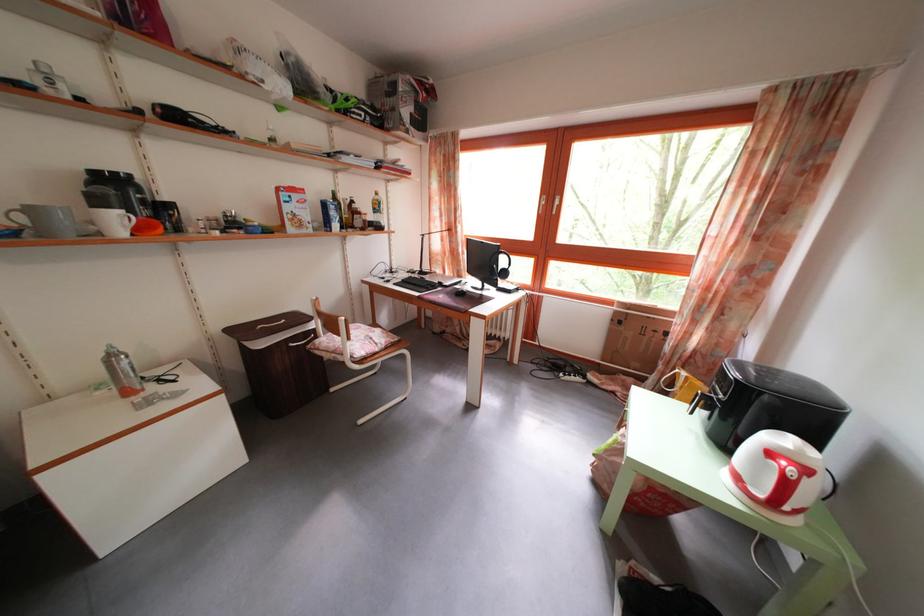
What do you see at coordinates (696, 387) in the screenshot? This screenshot has height=616, width=924. I see `a coffee pot handle` at bounding box center [696, 387].